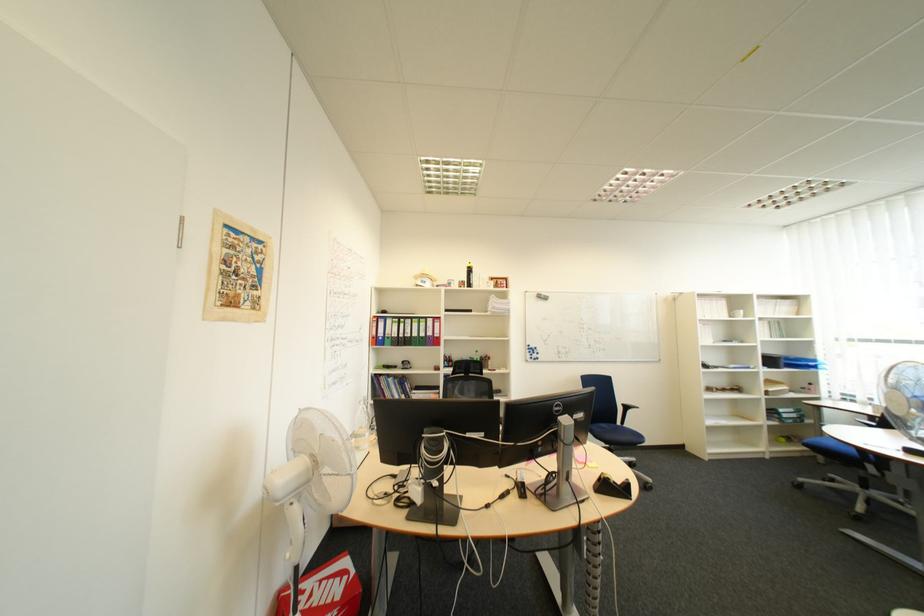
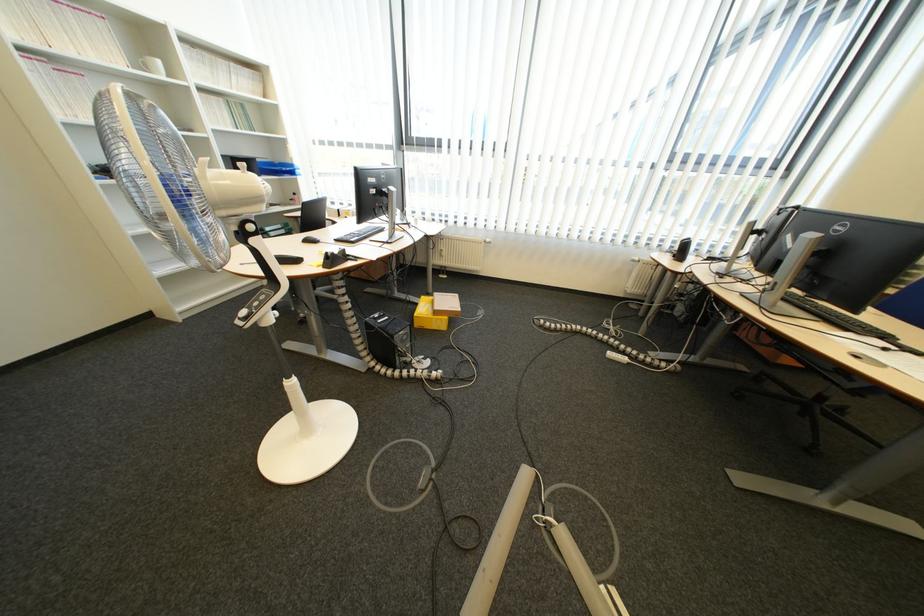
Locate, in the second image, the point that corresponds to the point at 781,459 in the first image.

(277, 285)